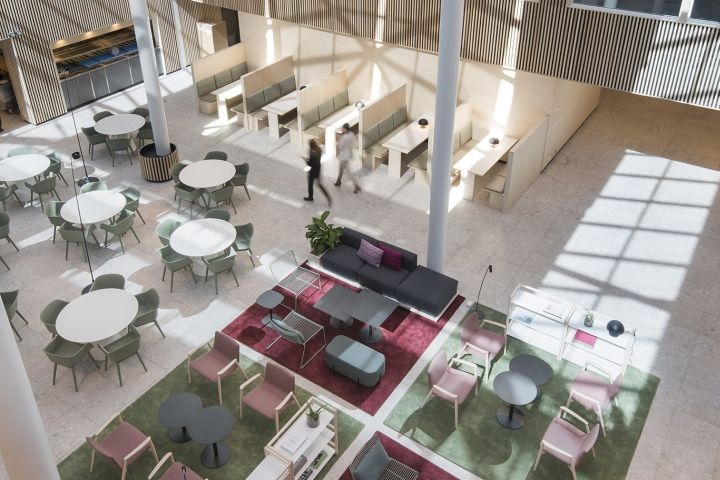
Identify the location of pillow / cushion on sofa. This screenshot has width=720, height=480. coord(345,261), coord(353,238), coord(369,250), coord(384,256), coord(409,260), coord(378,272), coord(415,291).